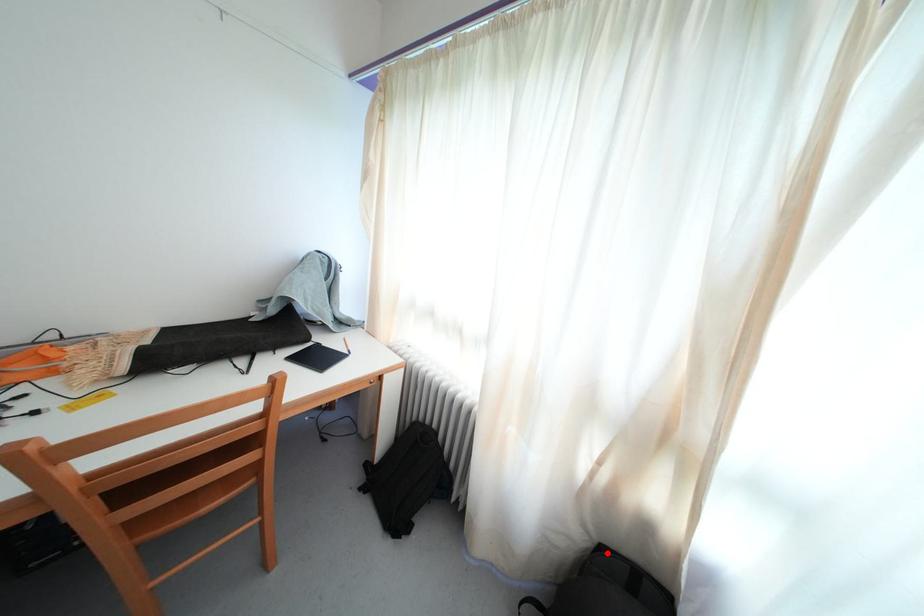
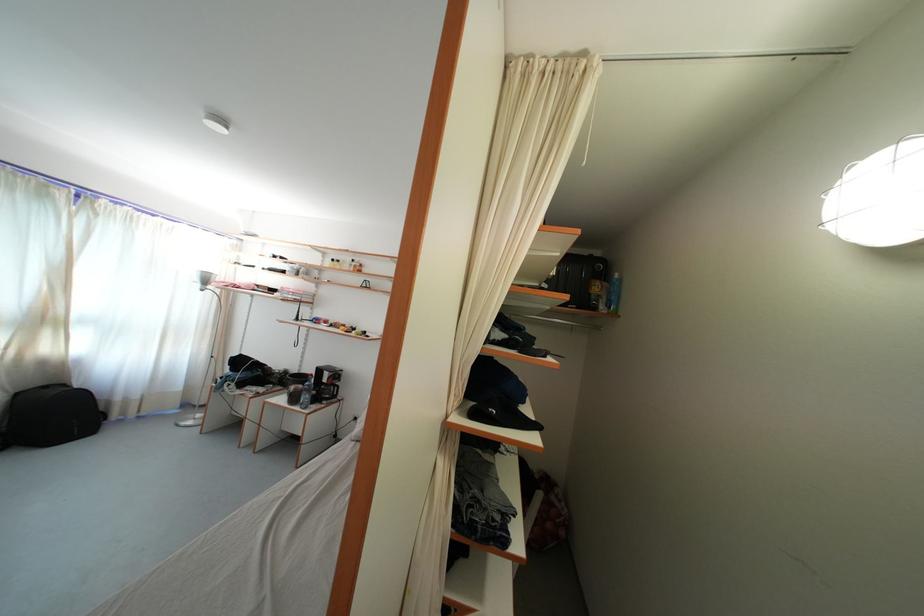
Question: I am providing you with two images of the same scene from different viewpoints. Image1 has a red point marked. In image2, the corresponding 3D location appears at what relative position? Reply with the corresponding letter.

Choices:
 (A) Closer
 (B) Farther

Answer: (B)